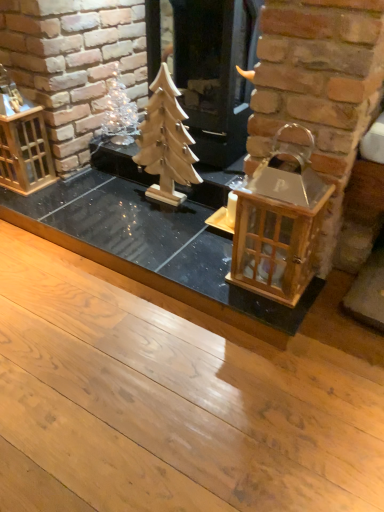
Question: Can you confirm if wooden lantern at right is bigger than wooden lantern at left?

Choices:
 (A) no
 (B) yes

Answer: (A)

Question: Is wooden lantern at right facing towards wooden lantern at left?

Choices:
 (A) no
 (B) yes

Answer: (A)

Question: Is wooden lantern at right touching wooden lantern at left?

Choices:
 (A) no
 (B) yes

Answer: (A)

Question: Is wooden lantern at right outside of wooden lantern at left?

Choices:
 (A) no
 (B) yes

Answer: (B)

Question: Does wooden lantern at right have a lesser height compared to wooden lantern at left?

Choices:
 (A) no
 (B) yes

Answer: (B)

Question: From a real-world perspective, is wooden lantern at right under wooden lantern at left?

Choices:
 (A) yes
 (B) no

Answer: (B)

Question: Is wooden lantern at right further to camera compared to wooden christmas tree at center?

Choices:
 (A) no
 (B) yes

Answer: (A)

Question: Does wooden lantern at right have a lesser height compared to wooden christmas tree at center?

Choices:
 (A) yes
 (B) no

Answer: (A)

Question: Is the surface of wooden lantern at right in direct contact with wooden christmas tree at center?

Choices:
 (A) no
 (B) yes

Answer: (A)

Question: Does wooden lantern at right have a larger size compared to wooden christmas tree at center?

Choices:
 (A) yes
 (B) no

Answer: (B)

Question: Is wooden lantern at right facing towards wooden christmas tree at center?

Choices:
 (A) no
 (B) yes

Answer: (A)

Question: Would you say wooden lantern at right contains wooden christmas tree at center?

Choices:
 (A) no
 (B) yes

Answer: (A)

Question: Does wooden christmas tree at center appear on the left side of wooden lantern at right?

Choices:
 (A) yes
 (B) no

Answer: (A)